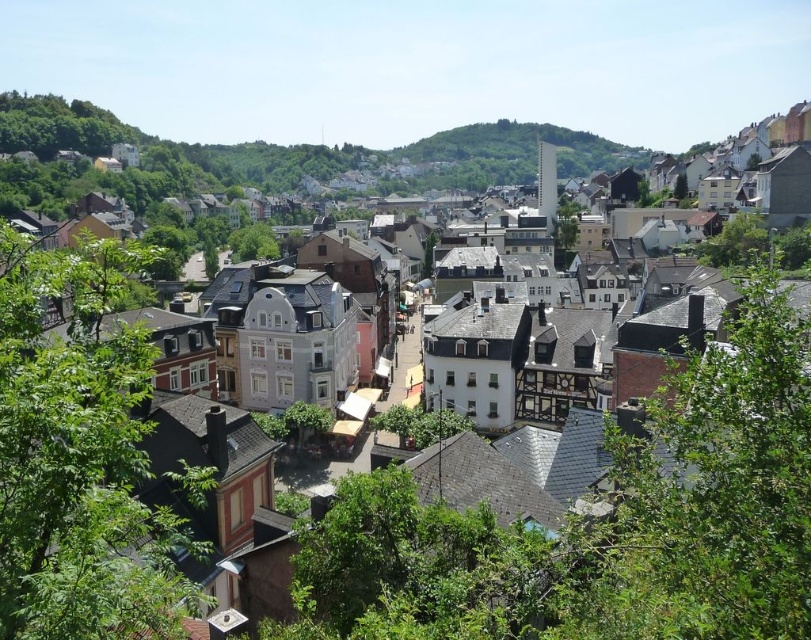
Does point (696, 541) come behind point (232, 259)?

No, it is not.

Does green leafy tree at lower right have a lesser height compared to green leafy tree at center?

Correct, green leafy tree at lower right is not as tall as green leafy tree at center.

What do you see at coordinates (706, 496) in the screenshot? I see `green leafy tree at lower right` at bounding box center [706, 496].

Identify the location of green leafy tree at lower right. This screenshot has height=640, width=811. (706, 496).

From the picture: Can you confirm if green leafy tree at lower right is thinner than green grassy hillside at center?

Yes, green leafy tree at lower right is thinner than green grassy hillside at center.

The image size is (811, 640). Find the location of `green leafy tree at lower right`. green leafy tree at lower right is located at coordinates (706, 496).

Locate an element on the screen. This screenshot has height=640, width=811. green leafy tree at lower right is located at coordinates (706, 496).

Is green leafy tree at lower left taller than green grassy hillside at center?

No.

Is point (97, 524) farther from camera compared to point (389, 184)?

No, (97, 524) is in front of (389, 184).

Where is `green leafy tree at lower left`? The height and width of the screenshot is (640, 811). green leafy tree at lower left is located at coordinates (79, 456).